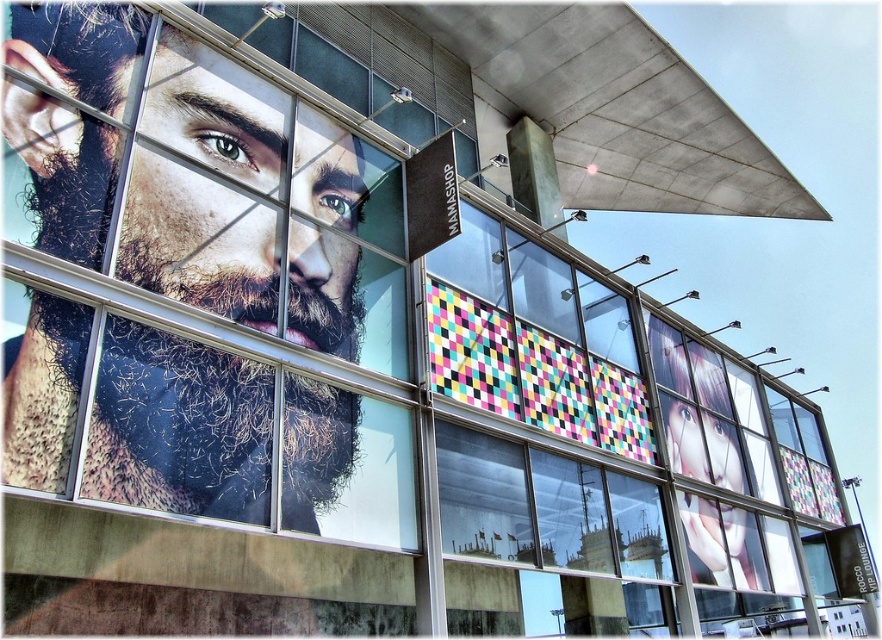
Can you confirm if beige textured beard at left is smaller than realistic skin portrait at upper left?

No, beige textured beard at left is not smaller than realistic skin portrait at upper left.

Between beige textured beard at left and realistic skin portrait at upper left, which one has less height?

realistic skin portrait at upper left is shorter.

Does point (35, 244) come in front of point (338, 129)?

Yes.

Where is `beige textured beard at left`? The width and height of the screenshot is (882, 640). beige textured beard at left is located at coordinates click(x=229, y=205).

In the scene shown: Does beige textured beard at left have a greater width compared to multicolored mosaic tiles at center?

No.

Is beige textured beard at left smaller than multicolored mosaic tiles at center?

Yes, beige textured beard at left is smaller than multicolored mosaic tiles at center.

The width and height of the screenshot is (882, 640). What do you see at coordinates (229, 205) in the screenshot? I see `beige textured beard at left` at bounding box center [229, 205].

Image resolution: width=882 pixels, height=640 pixels. In order to click on beige textured beard at left in this screenshot , I will do `click(229, 205)`.

Does point (126, 205) come closer to viewer compared to point (606, 429)?

Yes, point (126, 205) is closer to viewer.

Locate an element on the screen. realistic skin portrait at upper left is located at coordinates (241, 202).

Between point (226, 301) and point (453, 330), which one is positioned behind?

The point (453, 330) is more distant.

The image size is (882, 640). Find the location of `realistic skin portrait at upper left`. realistic skin portrait at upper left is located at coordinates (241, 202).